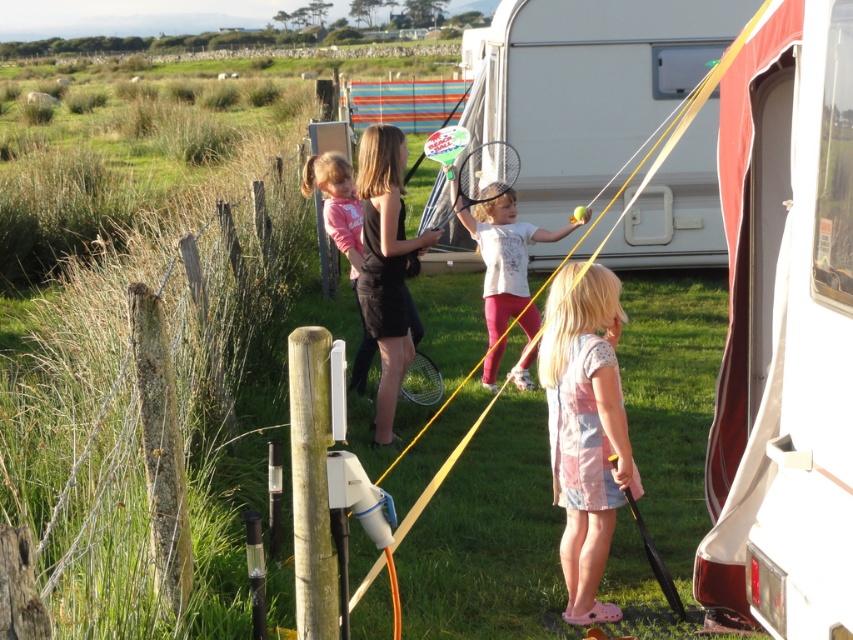
Question: Which point is farther to the camera?

Choices:
 (A) 643,538
 (B) 398,173
 (C) 805,42
 (D) 502,176

Answer: (D)

Question: Observing the image, what is the correct spatial positioning of white matte tennis racket at center in reference to black rubber tennis racket at center?

Choices:
 (A) left
 (B) right

Answer: (A)

Question: Can you confirm if patchwork cotton dress at center is positioned above white matte tennis racket at center?

Choices:
 (A) yes
 (B) no

Answer: (B)

Question: Which of the following is the farthest from the observer?

Choices:
 (A) (547, 333)
 (B) (422, 371)
 (C) (383, 282)
 (D) (822, 451)

Answer: (B)

Question: Is white matte tennis racket at center positioned at the back of metallic silver racket at center?

Choices:
 (A) yes
 (B) no

Answer: (B)

Question: Which object appears farthest from the camera in this image?

Choices:
 (A) metallic silver racket at center
 (B) black rubber tennis racket at center
 (C) black matte dress at center

Answer: (A)